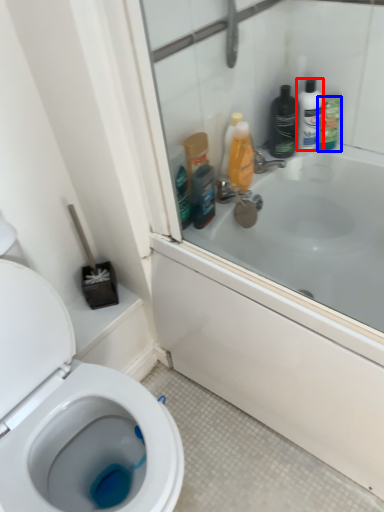
Question: Which object is further to the camera taking this photo, toiletry (highlighted by a red box) or cleaning product (highlighted by a blue box)?

Choices:
 (A) toiletry
 (B) cleaning product

Answer: (B)